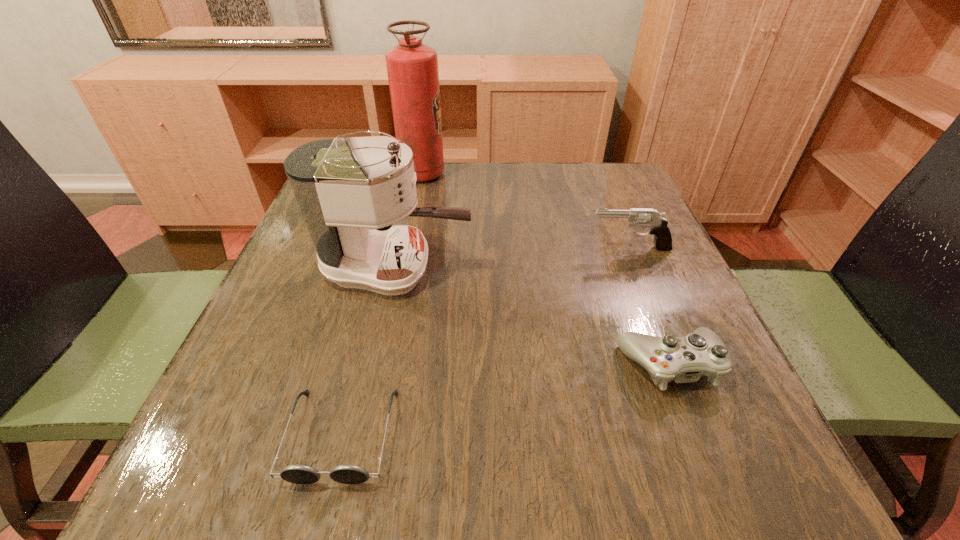
Identify the location of vacant point that satisfies the following two spatial constraints: 1. on the label side of the tallest object; 2. on the right side of the second shortest object. (386, 364).